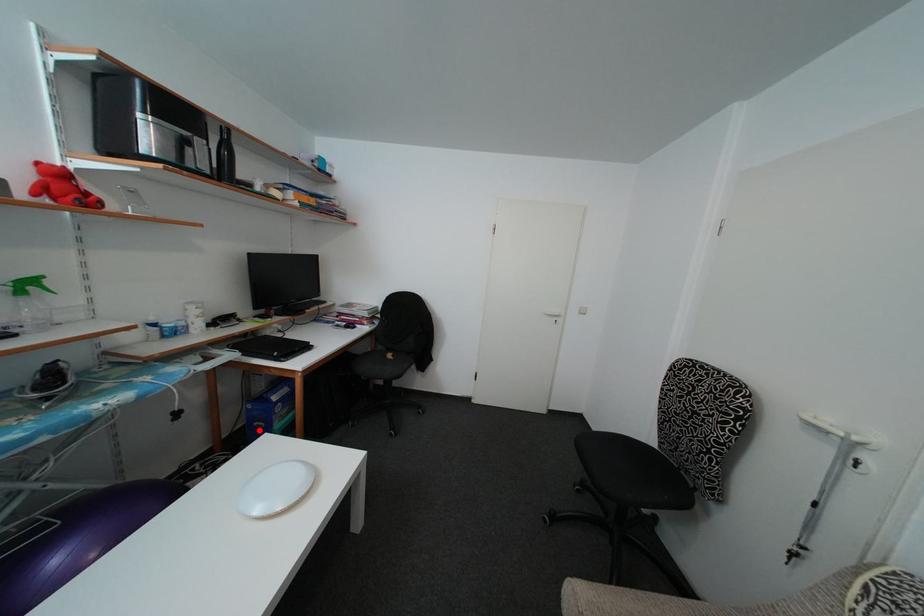
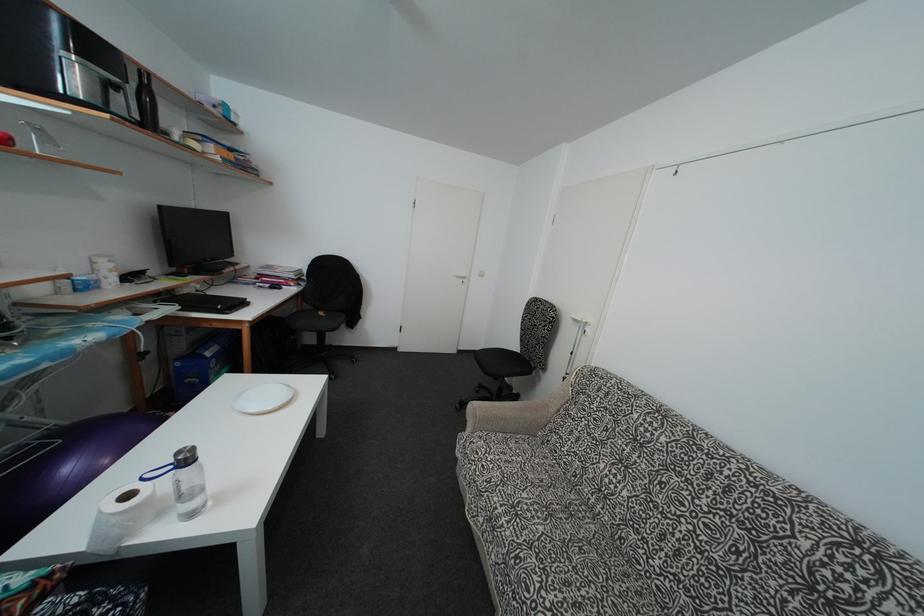
Where in the second image is the point corresponding to the highlighted location from the first image?

(190, 387)